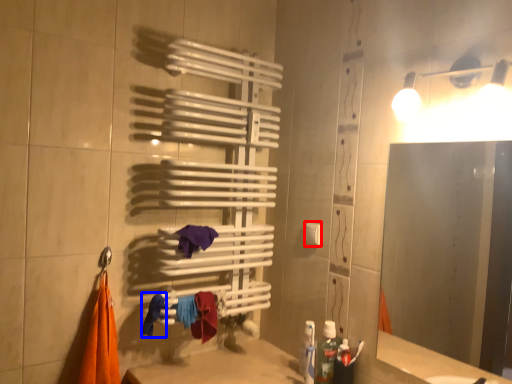
Question: Among these objects, which one is nearest to the camera, towel bar (highlighted by a red box) or clothe (highlighted by a blue box)?

Choices:
 (A) towel bar
 (B) clothe

Answer: (B)